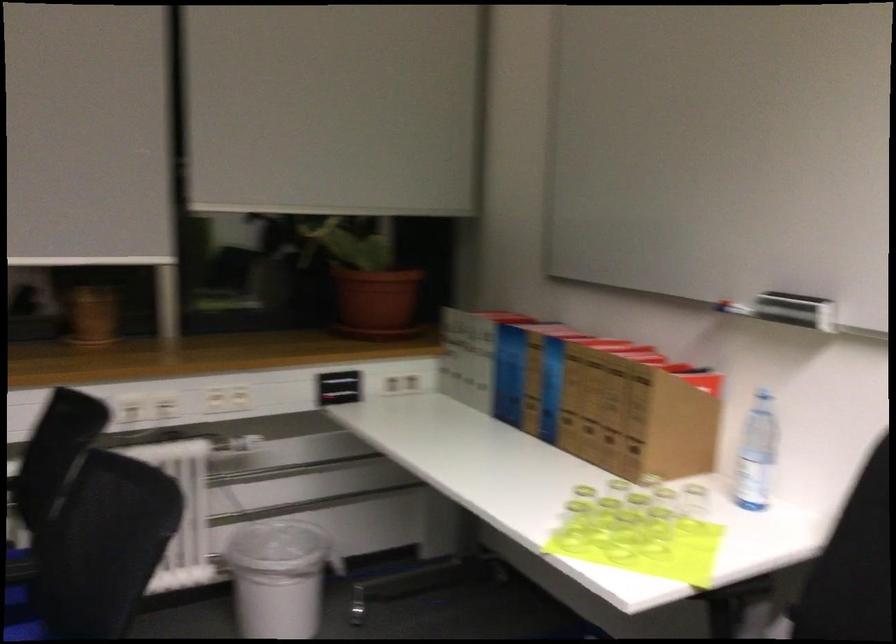
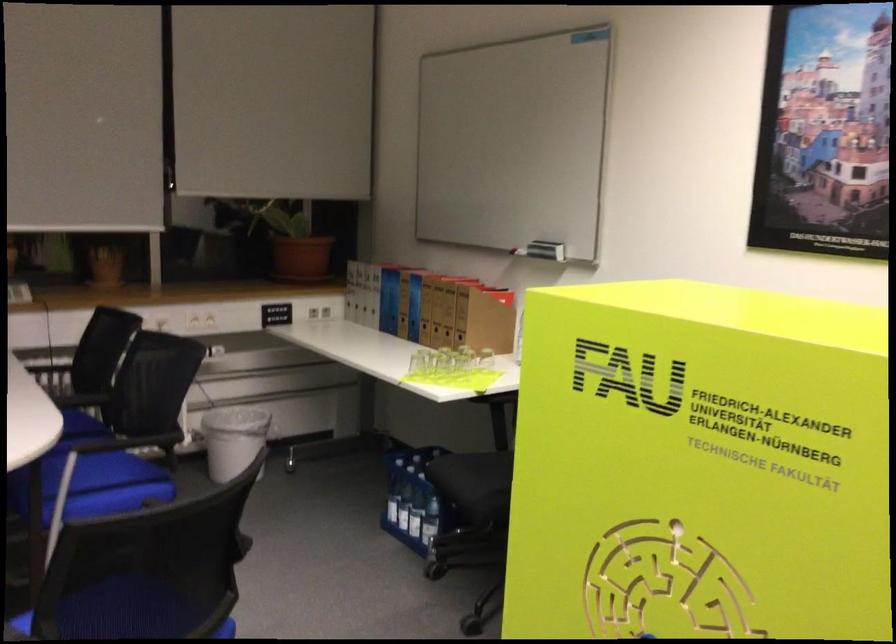
Find the pixel in the second image that matches the point at 519,404 in the first image.

(398, 317)